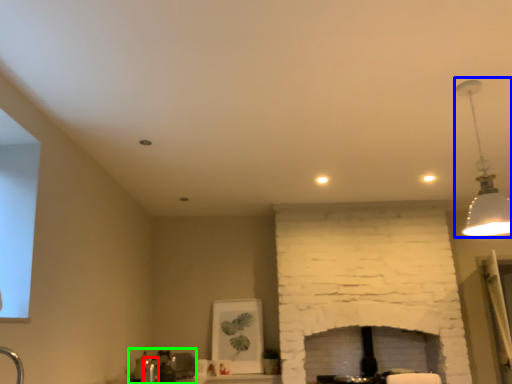
Question: Which is nearer to the faucet (highlighted by a red box)? lamp (highlighted by a blue box) or sink (highlighted by a green box).

Choices:
 (A) lamp
 (B) sink

Answer: (B)